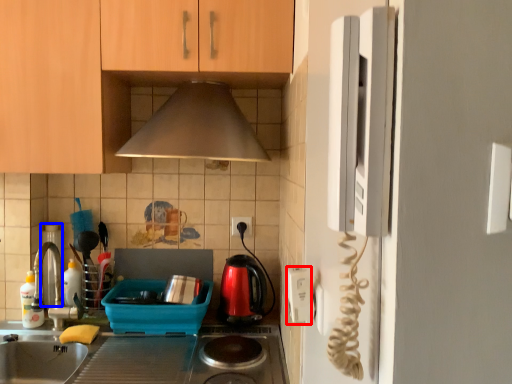
Question: Which object is further to the camera taking this photo, electric outlet (highlighted by a red box) or appliance (highlighted by a blue box)?

Choices:
 (A) electric outlet
 (B) appliance

Answer: (B)